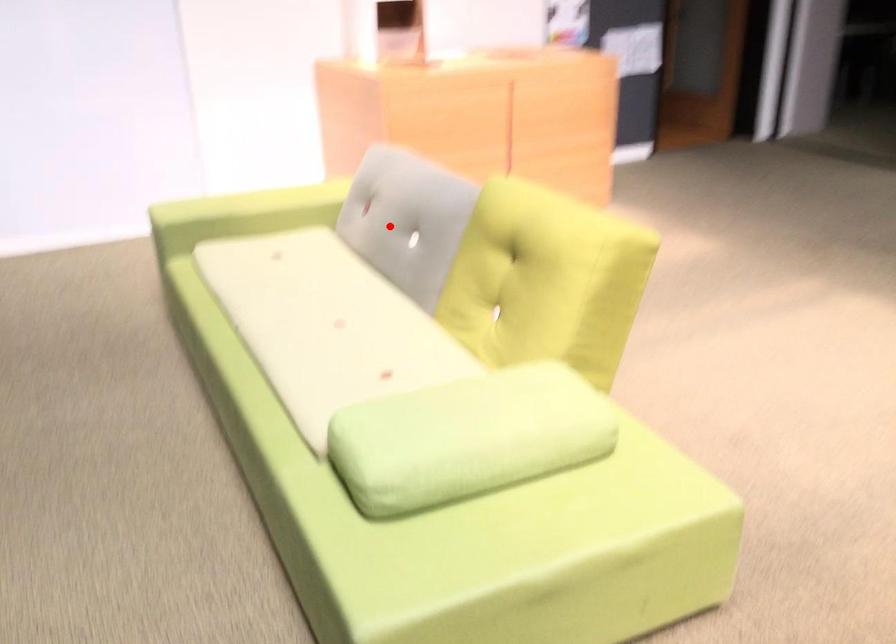
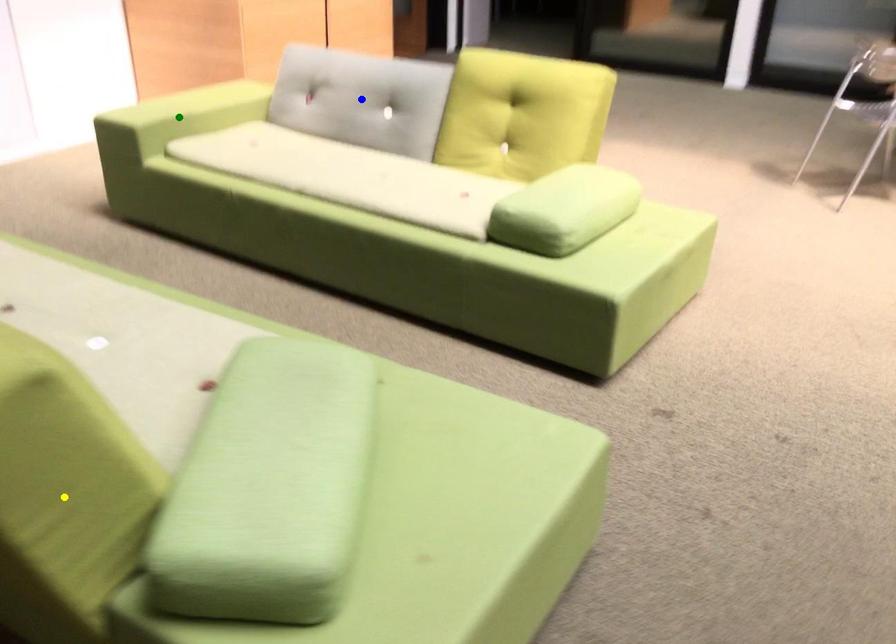
Question: I am providing you with two images of the same scene from different viewpoints. A red point is marked on the first image. You are given multiple points on the second image. Which mark in image 2 goes with the point in image 1?

Choices:
 (A) blue point
 (B) yellow point
 (C) green point

Answer: (A)